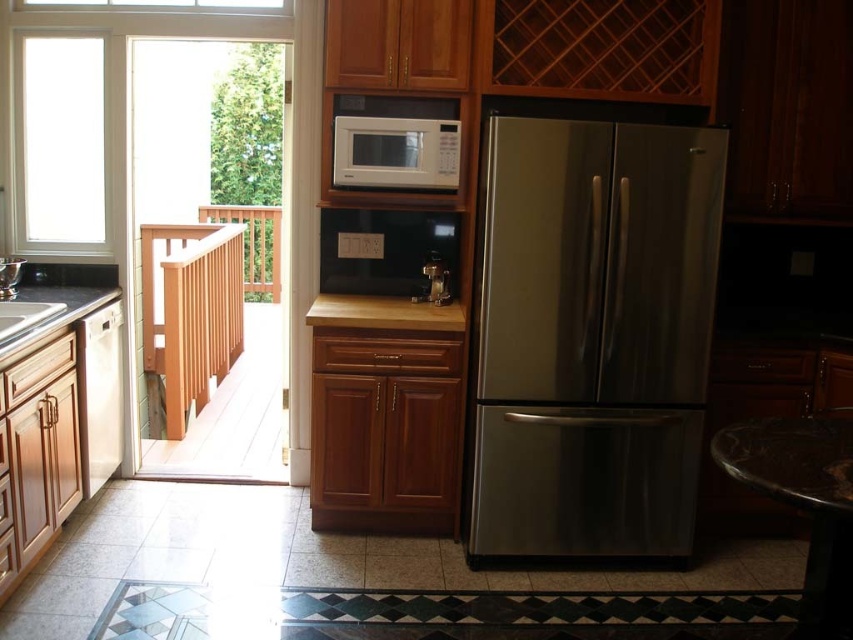
You are a chef preparing to place a hot dish on a surface in the kitchen. You have the stainless steel refrigerator at center and the brown wood counter at center available. Which surface is suitable for placing the hot dish?

The brown wood counter at center is suitable for placing the hot dish because the stainless steel refrigerator at center is located below it and refrigerators are not meant for placing hot items.

You are a kitchen designer planning to install a new ventilation system. You need to place a vent above the microwave to ensure proper airflow. Given the current setup, is there enough vertical space between the white glass window at upper left and the white matte microwave at center to accommodate a standard 30 cm tall vent?

The white glass window at upper left is positioned over the white matte microwave at center, so there is sufficient vertical space to install a 30 cm tall vent between them.